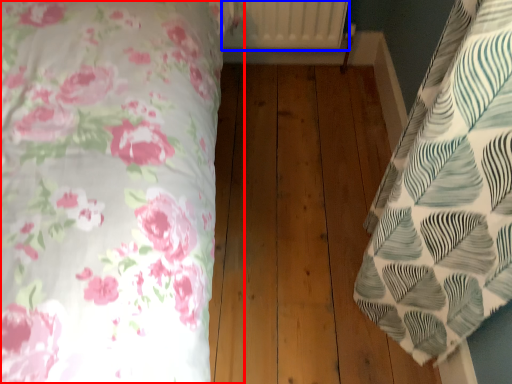
Question: Which object is closer to the camera taking this photo, bed (highlighted by a red box) or radiator (highlighted by a blue box)?

Choices:
 (A) bed
 (B) radiator

Answer: (A)